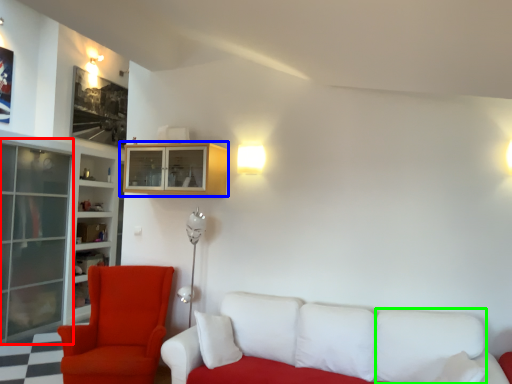
Question: Which is farther away from glass door (highlighted by a red box)? cabinetry (highlighted by a blue box) or pillow (highlighted by a green box)?

Choices:
 (A) cabinetry
 (B) pillow

Answer: (B)